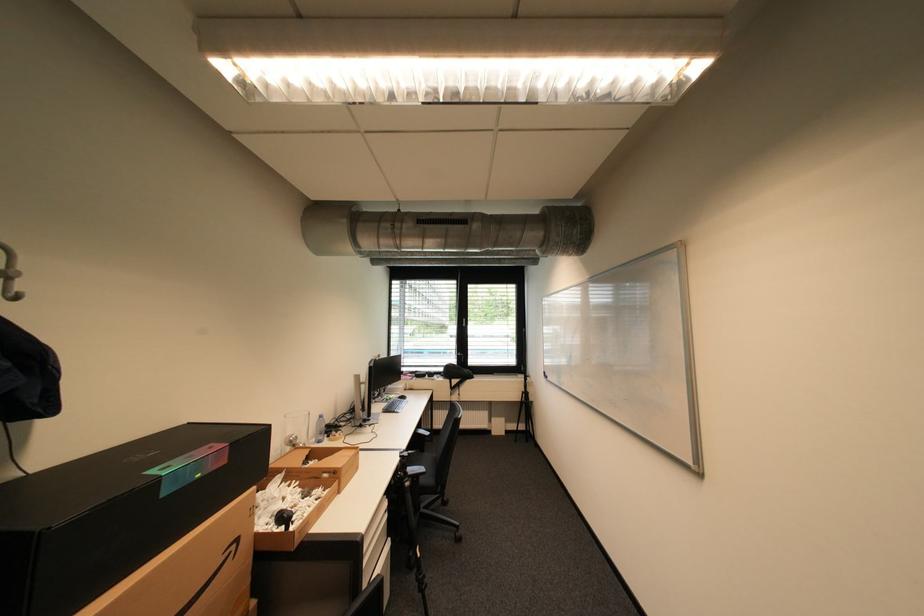
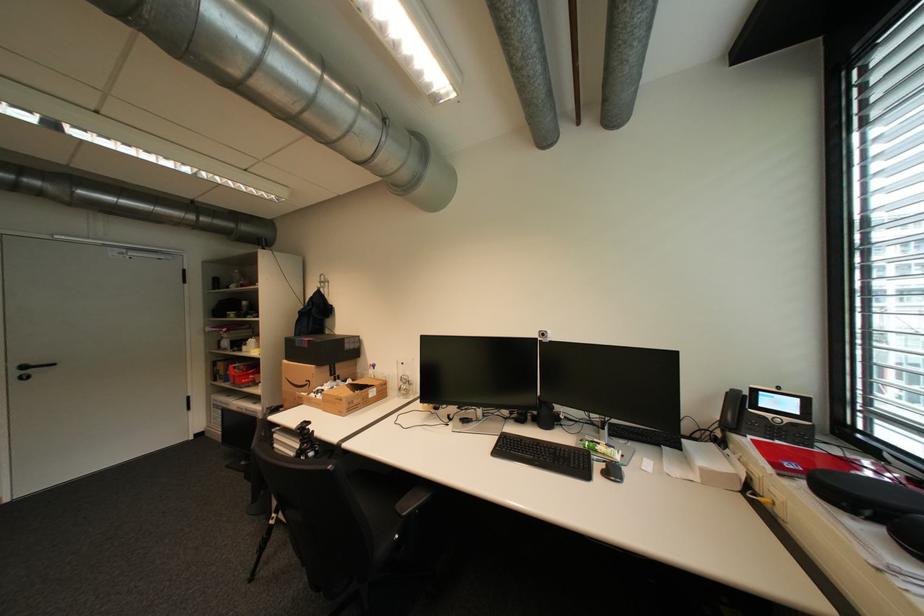
Find the pixel in the second image that matches (242,546) in the first image.

(317, 383)